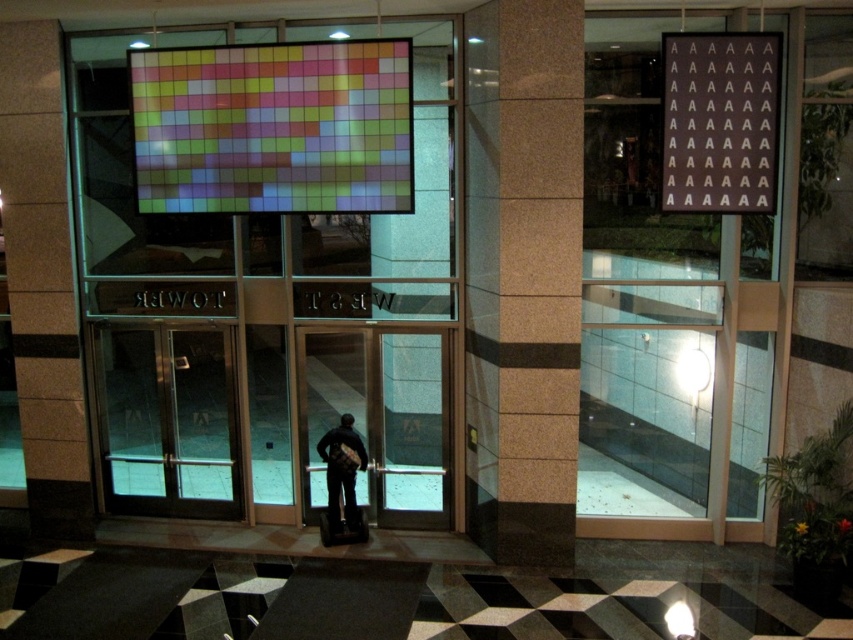
Does brown polished stone pillar at center appear on the right side of dark gray fabric jacket at center?

Yes, brown polished stone pillar at center is to the right of dark gray fabric jacket at center.

Does brown polished stone pillar at center have a lesser width compared to dark gray fabric jacket at center?

Incorrect, brown polished stone pillar at center's width is not less than dark gray fabric jacket at center's.

This screenshot has width=853, height=640. In order to click on brown polished stone pillar at center in this screenshot , I will do `click(534, 284)`.

What are the coordinates of `brown polished stone pillar at center` in the screenshot? It's located at (534, 284).

Can you confirm if transparent glass door at center is thinner than dark gray fabric jacket at center?

No.

Does transparent glass door at center have a greater width compared to dark gray fabric jacket at center?

Correct, the width of transparent glass door at center exceeds that of dark gray fabric jacket at center.

Find the location of a particular element. The height and width of the screenshot is (640, 853). transparent glass door at center is located at coordinates (167, 420).

The width and height of the screenshot is (853, 640). What are the coordinates of `transparent glass door at center` in the screenshot? It's located at (167, 420).

Is brown polished stone pillar at center to the right of multicolored pixelated display at center from the viewer's perspective?

Yes, brown polished stone pillar at center is to the right of multicolored pixelated display at center.

Is brown polished stone pillar at center wider than multicolored pixelated display at center?

In fact, brown polished stone pillar at center might be narrower than multicolored pixelated display at center.

Is point (537, 156) in front of point (210, 108)?

Yes, point (537, 156) is closer to viewer.

Where is `brown polished stone pillar at center`? brown polished stone pillar at center is located at coordinates (534, 284).